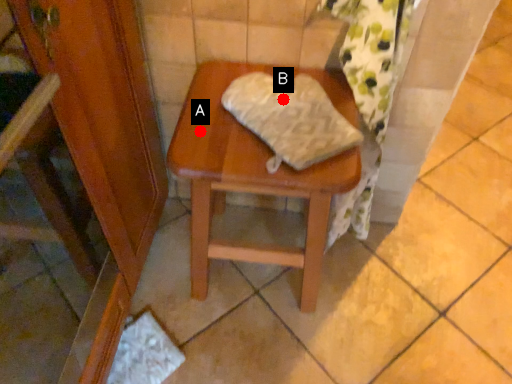
Question: Two points are circled on the image, labeled by A and B beside each circle. Which point appears farthest from the camera in this image?

Choices:
 (A) A is further
 (B) B is further

Answer: (B)